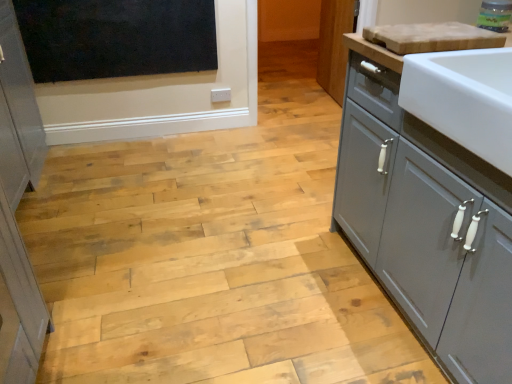
This screenshot has width=512, height=384. In order to click on vacant space that is to the left of matte gray cabinet at right in this screenshot , I will do `click(282, 94)`.